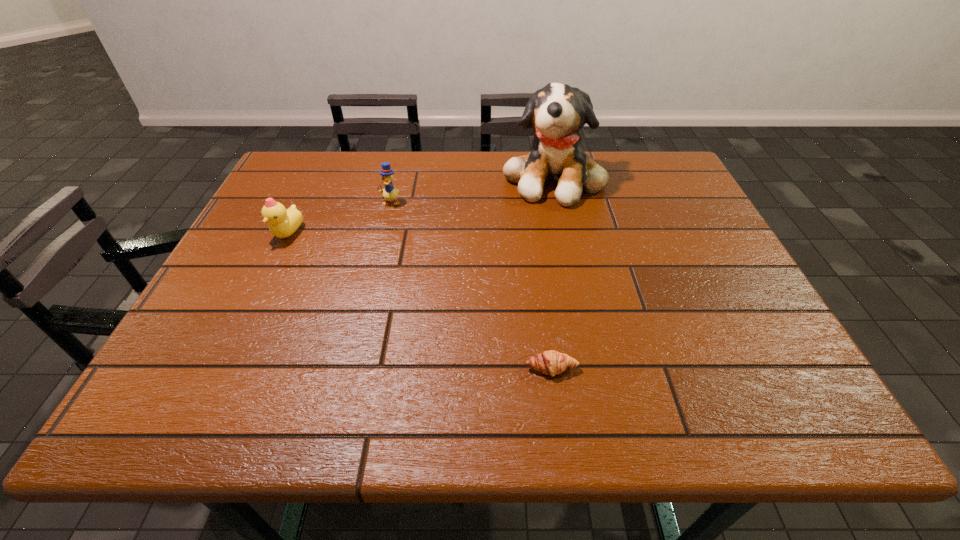
Where is `puppy`? Image resolution: width=960 pixels, height=540 pixels. puppy is located at coordinates (557, 112).

Find the location of a particular element. This screenshot has width=960, height=540. the third object from right to left is located at coordinates (389, 193).

Locate an element on the screen. the farther duckling is located at coordinates coord(389,193).

Identify the location of the left duckling. (283, 222).

Image resolution: width=960 pixels, height=540 pixels. In order to click on the leftmost object in this screenshot , I will do `click(283, 222)`.

The height and width of the screenshot is (540, 960). Find the location of `the shortest object`. the shortest object is located at coordinates (550, 362).

The height and width of the screenshot is (540, 960). Identify the location of the nearest object. (550, 362).

Find the location of a particular element. vacant point located at the face of the puppy is located at coordinates (567, 244).

The width and height of the screenshot is (960, 540). I want to click on free region located on the face of the right duckling, where the monocle is placed, so click(371, 286).

Where is `vacant space located on the front-facing side of the nearer duckling`? vacant space located on the front-facing side of the nearer duckling is located at coordinates (266, 280).